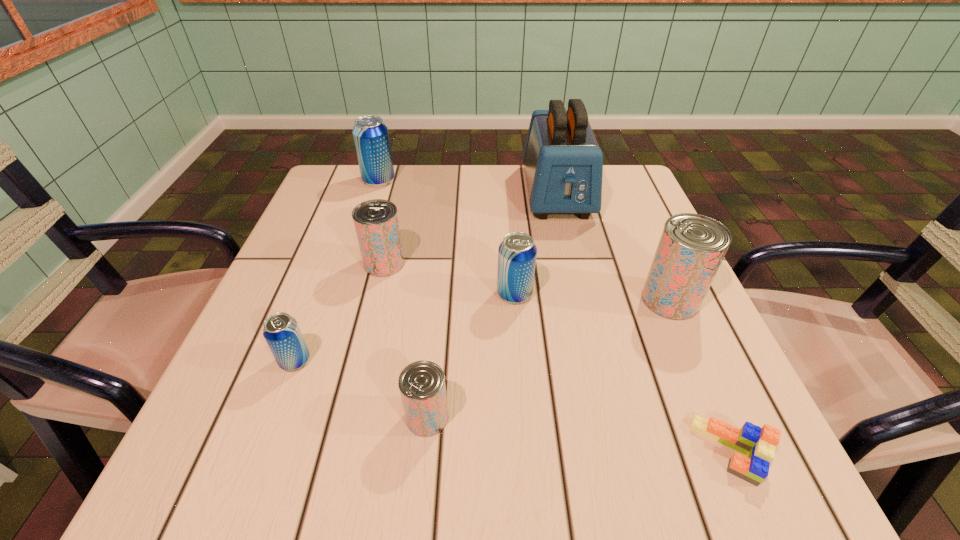
You are a GUI agent. You are given a task and a screenshot of the screen. Output one action in this format:
    pyautogui.click(x=<x>, y=<y>)
    Task: Click on the free space located on the back of the second biggest blue beer can
    Image resolution: width=960 pixels, height=540 pixels.
    Given the screenshot: What is the action you would take?
    pyautogui.click(x=511, y=247)

What are the coordinates of `vacant point located on the right of the smallest blue beer can` in the screenshot? It's located at (428, 361).

Identify the location of vacant region located 0.270m on the right of the nearest beer can. (626, 417).

At what (x,y) coordinates should I click in order to perform the action: click on vacant space located 0.320m on the back of the shortest object. Please return your answer as a coordinate pair (x, y). This screenshot has width=960, height=540. Looking at the image, I should click on (656, 275).

The image size is (960, 540). I want to click on toaster positioned at the far edge, so click(x=563, y=162).

At what (x,y) coordinates should I click in order to perform the action: click on beer can that is positioned at the far edge. Please return your answer as a coordinate pair (x, y). The width and height of the screenshot is (960, 540). Looking at the image, I should click on (371, 137).

This screenshot has height=540, width=960. In order to click on beer can at the near edge in this screenshot , I will do `click(422, 387)`.

Find the location of `Lego that is at the near edge`. Lego that is at the near edge is located at coordinates (758, 444).

The width and height of the screenshot is (960, 540). What are the coordinates of `toaster positioned at the right edge` in the screenshot? It's located at (563, 162).

Locate an element on the screen. This screenshot has width=960, height=540. beer can present at the right edge is located at coordinates (691, 248).